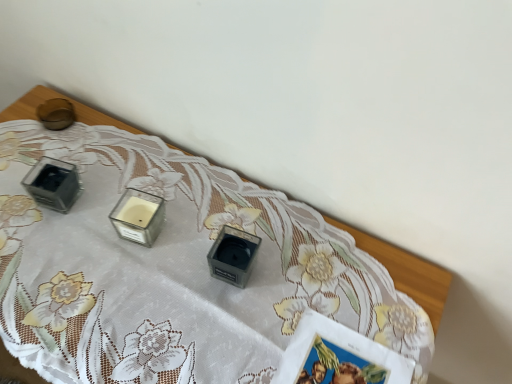
Image resolution: width=512 pixels, height=384 pixels. Identify the location of free space on the front side of clear glass candle at center. (117, 295).